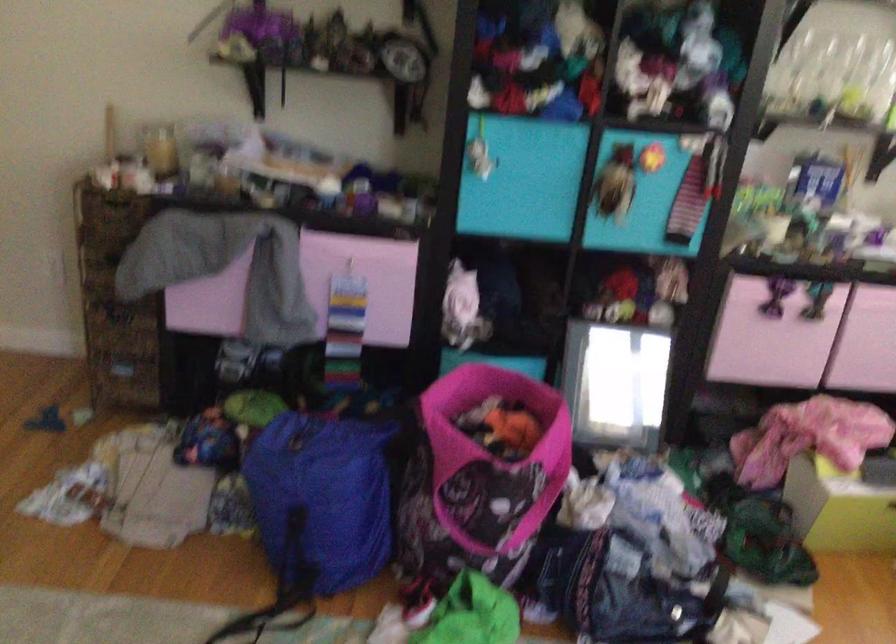
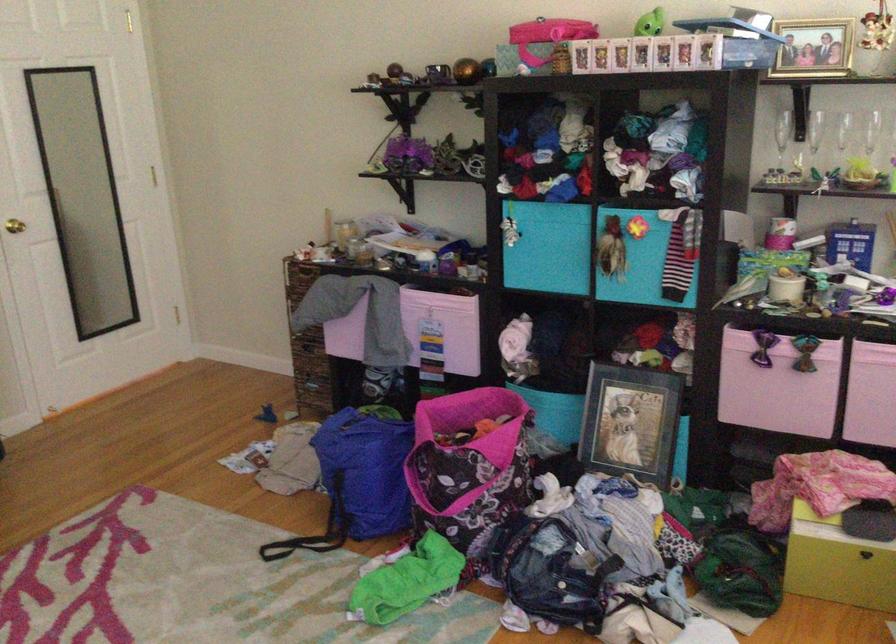
Find the pixel in the second image that matches pixel 785 232 in the first image.

(786, 289)